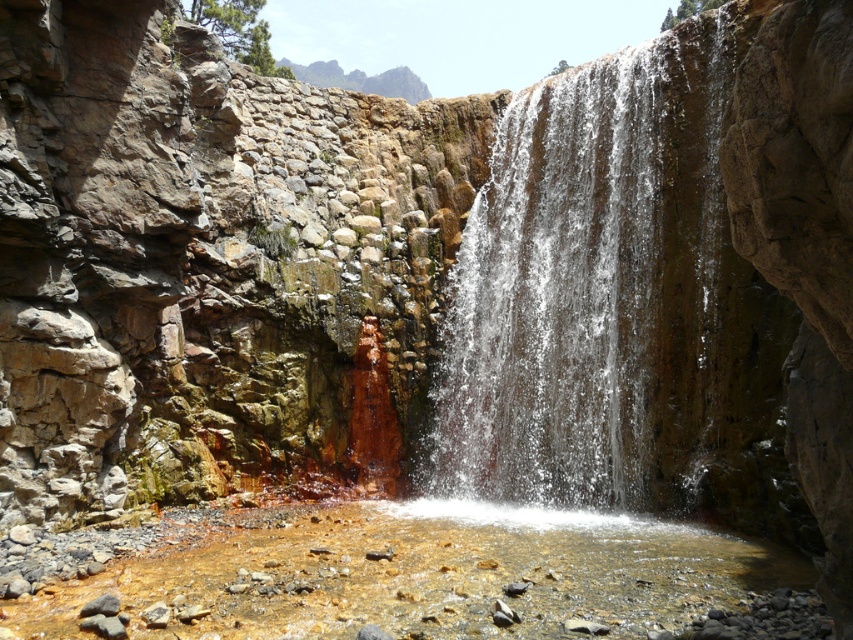
Based on the photo, you are standing at the edge of the pool and want to reach the point marked at point (579, 296). To get there, you must first pass through point (410, 520). Is this necessary?

Yes, because point (579, 296) is behind point (410, 520), so you must pass through point (410, 520) first to reach it.

You are standing at the edge of the waterfall and want to cross to the other side. You see clear water at center and translucent amber water at center. Which body of water should you step into first to reach the other side?

You should step into the clear water at center first because it is closer to you than the translucent amber water at center, which is further away.